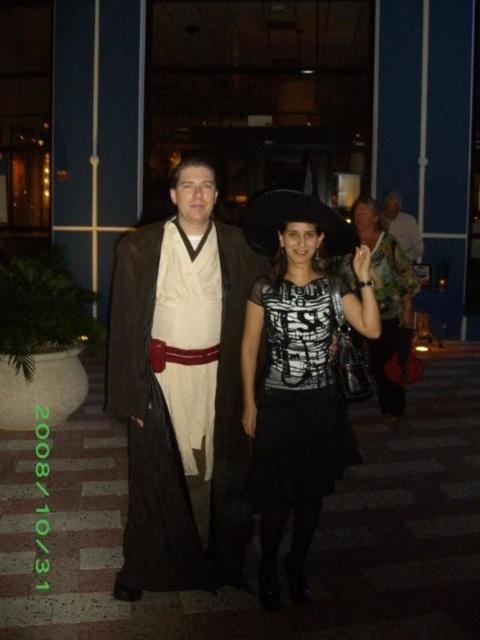
Question: Which of these objects is positioned farthest from the black matte dress at center?

Choices:
 (A) white fabric shirt at center
 (B) shiny black dress at center

Answer: (A)

Question: Is brown matte robe at center further to the viewer compared to white fabric shirt at center?

Choices:
 (A) yes
 (B) no

Answer: (B)

Question: Which point is closer to the camera?

Choices:
 (A) black matte dress at center
 (B) shiny black dress at center
 (C) black mesh dress at center

Answer: (A)

Question: Is black mesh dress at center positioned before shiny black dress at center?

Choices:
 (A) no
 (B) yes

Answer: (B)

Question: Does black mesh dress at center appear over shiny black dress at center?

Choices:
 (A) no
 (B) yes

Answer: (A)

Question: Among these points, which one is nearest to the camera?

Choices:
 (A) (323, 294)
 (B) (404, 252)
 (C) (172, 432)

Answer: (A)